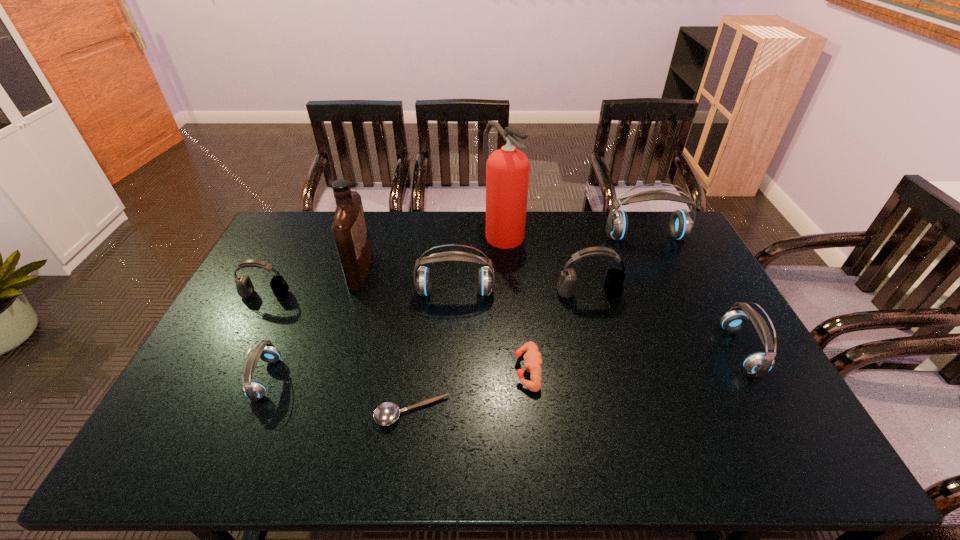
Where is `vacant region located on the label side of the third object from left to right`? The width and height of the screenshot is (960, 540). vacant region located on the label side of the third object from left to right is located at coordinates click(x=473, y=271).

At what (x,y) coordinates should I click in order to perform the action: click on vacant space located on the ear cups of the biggest blue headset. Please return your answer as a coordinate pair (x, y). Looking at the image, I should click on (682, 315).

Locate an element on the screen. The width and height of the screenshot is (960, 540). vacant region located on the headband of the third object from right to left is located at coordinates (594, 316).

I want to click on blank area located 0.320m on the ear cups of the second biggest blue headset, so click(449, 389).

Identify the location of free space located 0.400m on the ear cups of the second smallest blue headset. (587, 350).

Find the location of a particular element. Image resolution: width=960 pixels, height=540 pixels. free space located 0.260m on the ear cups of the second smallest blue headset is located at coordinates (636, 350).

Identify the location of free space located on the ear cups of the second smallest blue headset. (675, 350).

Where is `free region located 0.210m on the headband of the leftmost object`? The image size is (960, 540). free region located 0.210m on the headband of the leftmost object is located at coordinates (235, 352).

The image size is (960, 540). In order to click on free region located on the ear cups of the ninth object from right to left in this screenshot , I will do `click(302, 379)`.

What are the coordinates of `vacant space located 0.400m with the gloves of the red puncher facing forward` in the screenshot? It's located at (368, 370).